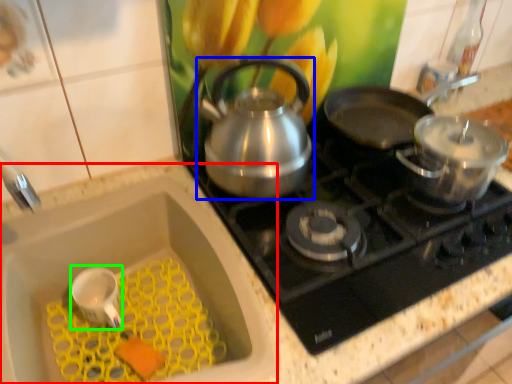
Question: Which is farther away from sink (highlighted by a red box)? kettle (highlighted by a blue box) or appliance (highlighted by a green box)?

Choices:
 (A) kettle
 (B) appliance

Answer: (A)